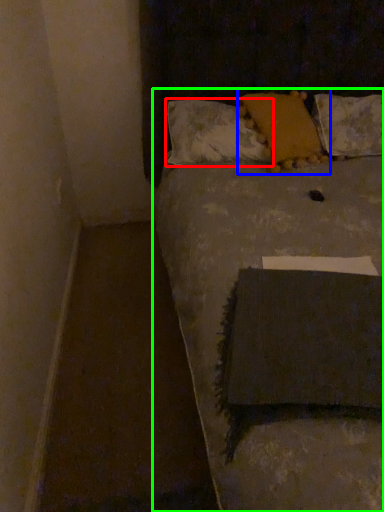
Question: Considering the real-world distances, which object is farthest from pillow (highlighted by a red box)? pillow (highlighted by a blue box) or furniture (highlighted by a green box)?

Choices:
 (A) pillow
 (B) furniture

Answer: (B)